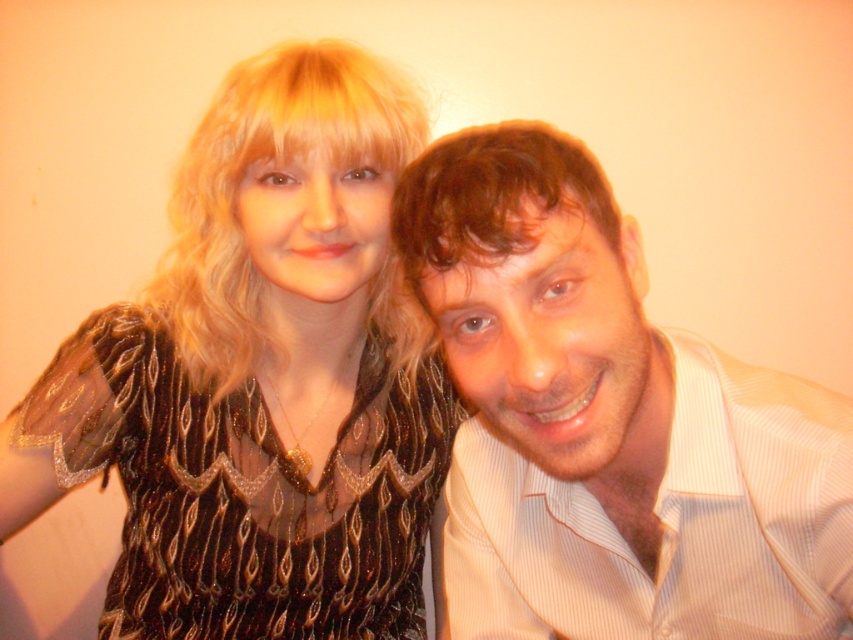
Question: Can you confirm if light brown striped shirt at center is smaller than black sequined dress at center?

Choices:
 (A) no
 (B) yes

Answer: (B)

Question: Among these objects, which one is farthest from the camera?

Choices:
 (A) black sequined dress at center
 (B) light brown striped shirt at center

Answer: (A)

Question: Does light brown striped shirt at center appear under black sequined dress at center?

Choices:
 (A) no
 (B) yes

Answer: (A)

Question: Which point is closer to the camera?

Choices:
 (A) black sequined dress at center
 (B) light brown striped shirt at center

Answer: (B)

Question: Can you confirm if light brown striped shirt at center is positioned below black sequined dress at center?

Choices:
 (A) yes
 (B) no

Answer: (B)